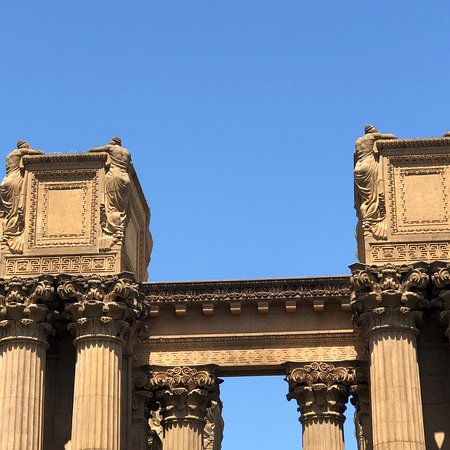
Where is `column`? column is located at coordinates (399, 391), (323, 439), (183, 436), (98, 410), (15, 408).